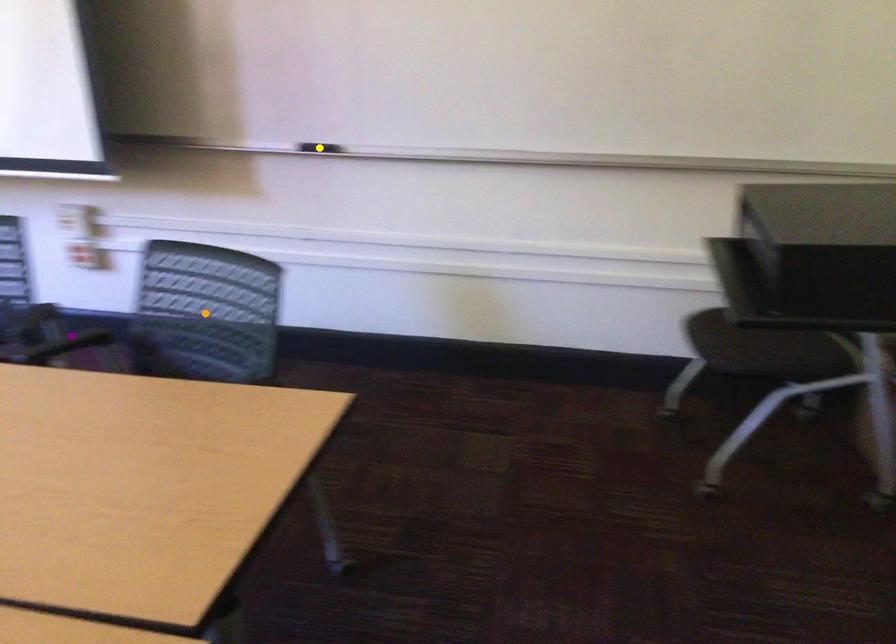
Order these from nearest to farthest:
yellow point | orange point | purple point

purple point → yellow point → orange point